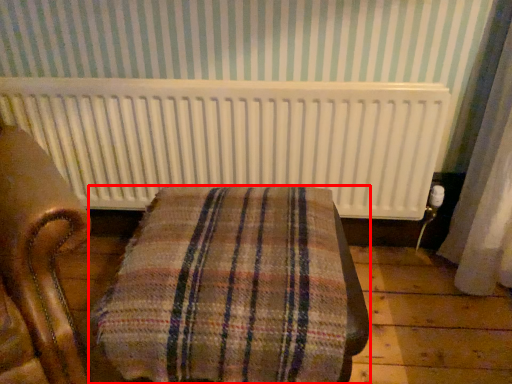
Question: In this image, where is furniture (annotated by the red box) located relative to radiator?

Choices:
 (A) right
 (B) left

Answer: (A)